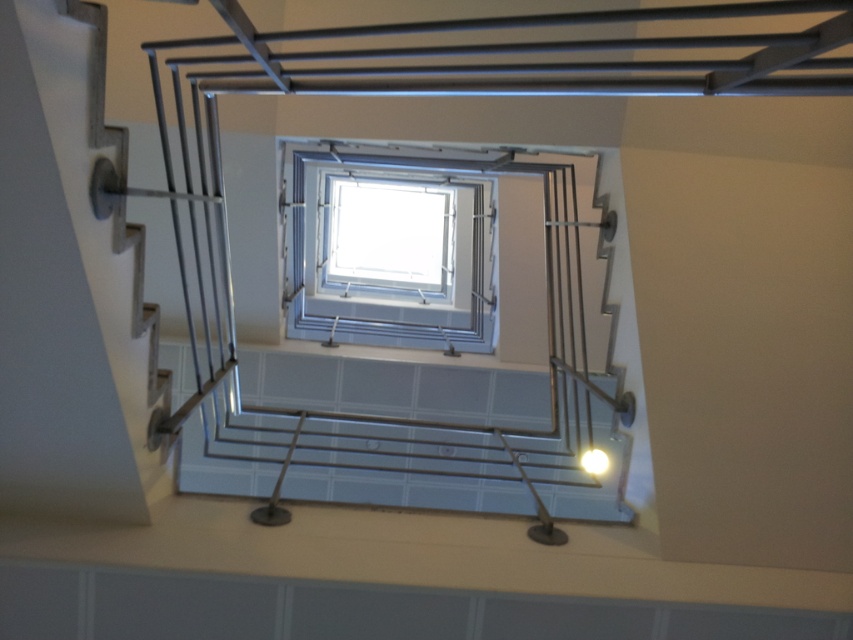
Question: Which point is closer to the camera taking this photo?

Choices:
 (A) (590, 474)
 (B) (460, 225)

Answer: (A)

Question: Which point is closer to the camera?

Choices:
 (A) bright yellow bulb at center
 (B) transparent glass window at center

Answer: (A)

Question: Can you confirm if transparent glass window at center is positioned to the right of bright yellow bulb at center?

Choices:
 (A) no
 (B) yes

Answer: (A)

Question: Which point is closer to the camera taking this photo?

Choices:
 (A) (596, 467)
 (B) (370, 180)

Answer: (A)

Question: Can you confirm if transparent glass window at center is positioned to the right of bright yellow bulb at center?

Choices:
 (A) yes
 (B) no

Answer: (B)

Question: Can you confirm if transparent glass window at center is smaller than bright yellow bulb at center?

Choices:
 (A) yes
 (B) no

Answer: (B)